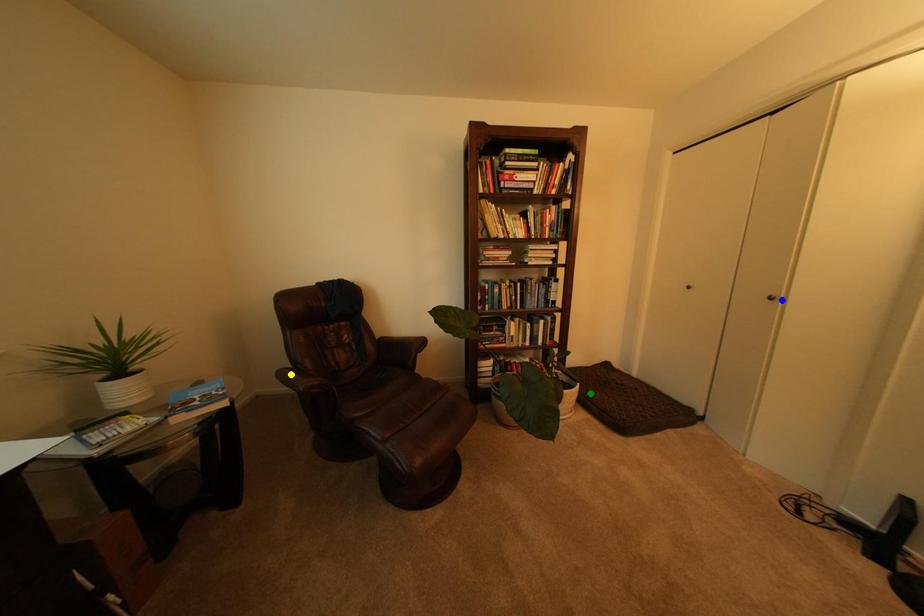
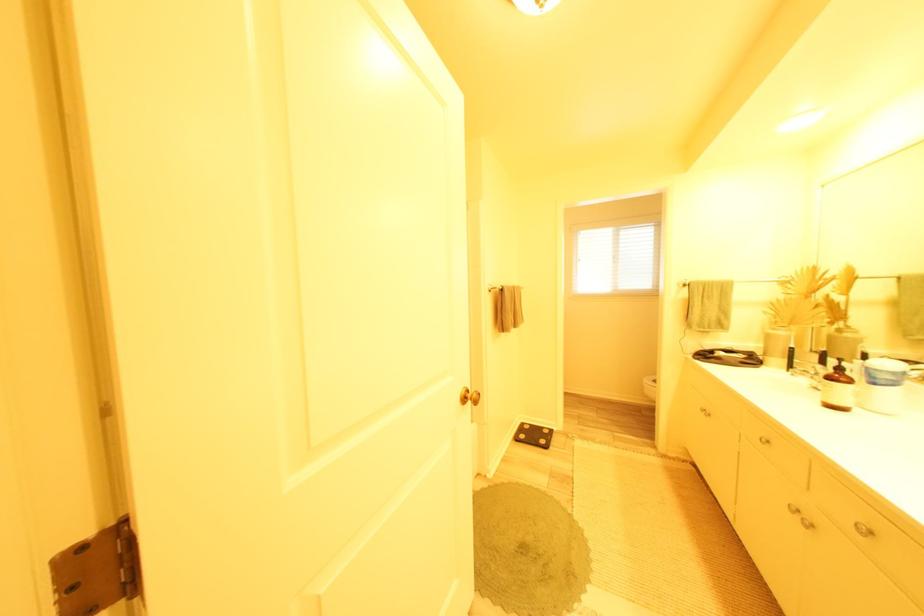
I am providing you with two images of the same scene from different viewpoints. Three points are marked in image1. Which point corresponds to a part or object that is occluded in image2?In image1, three points are marked. Which of them correspond to a part or object that is occluded in image2?Among the three points shown in image1, which one corresponds to a part or object that is no longer visible due to occlusion in image2?

Invisible in image2: blue point, yellow point, green point.